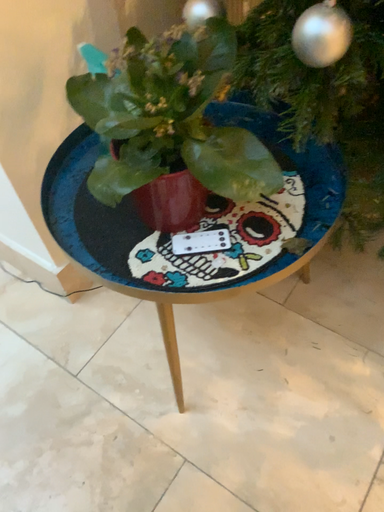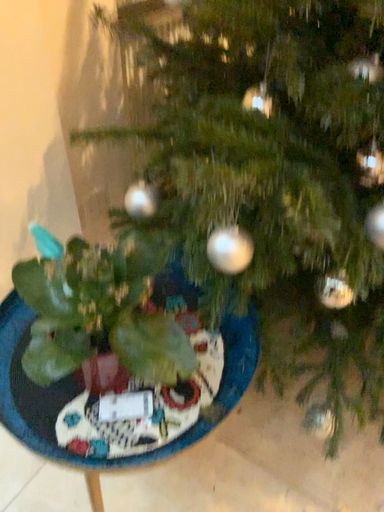
Question: Which way did the camera rotate in the video?

Choices:
 (A) rotated downward
 (B) rotated upward

Answer: (B)